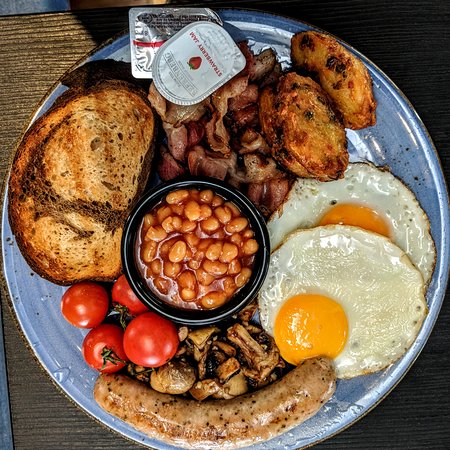
You are a GUI agent. You are given a task and a screenshot of the screen. Output one action in this format:
    pyautogui.click(x=<x>, y=<y>)
    Task: Click on the surface
    
    Given the screenshot: What is the action you would take?
    pyautogui.click(x=42, y=58)